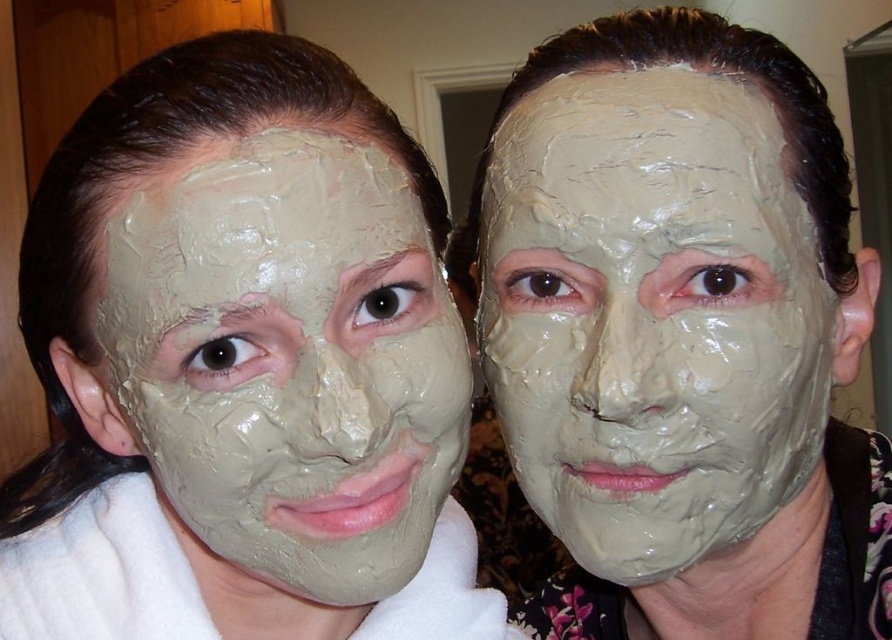
You are a photographer trying to capture a closeup of the matte clay mask at left without the matte clay mask at center blocking the view. Is it possible to adjust your position to achieve this?

The matte clay mask at left is behind the matte clay mask at center, so you cannot adjust your position to capture the matte clay mask at left without the matte clay mask at center blocking the view.

You are a spa attendant and need to choose the appropriate clay mask size for a client. The client has a smaller face. Which matte clay mask should you select between the matte clay mask at center and the matte clay mask at left?

The matte clay mask at center has a smaller size compared to the matte clay mask at left, so you should choose the matte clay mask at center for the client with a smaller face.